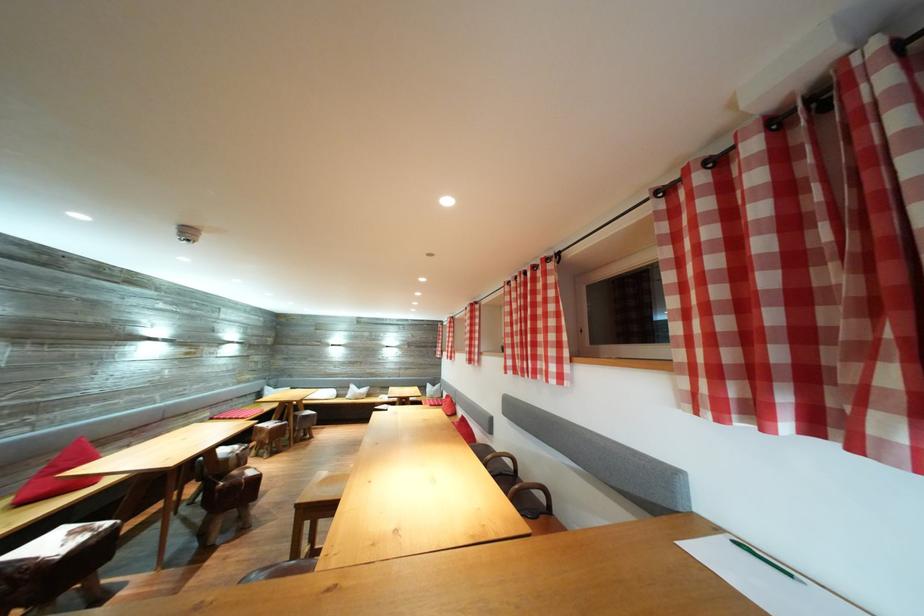
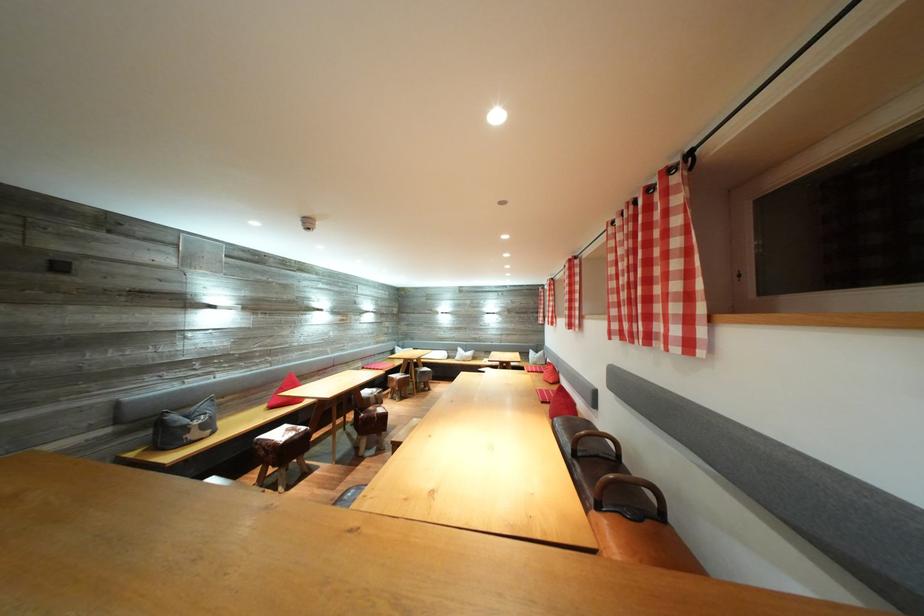
In the second image, find the point that corresponds to the point at 257,477 in the first image.

(386, 416)